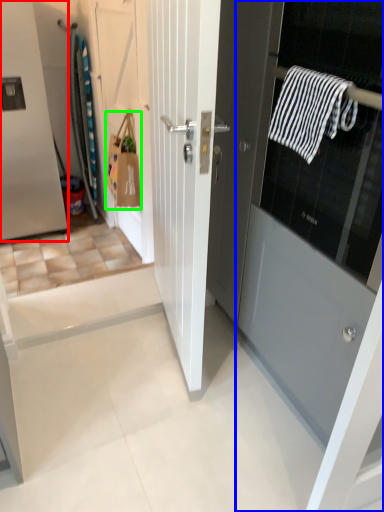
Question: Which is nearer to the door (highlighted by a red box)? door (highlighted by a blue box) or shopping bag (highlighted by a green box).

Choices:
 (A) door
 (B) shopping bag

Answer: (B)